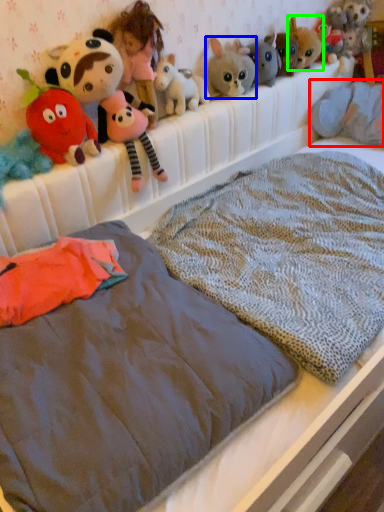
Question: Which is nearer to the animal (highlighted by a red box)? toy (highlighted by a blue box) or toy (highlighted by a green box).

Choices:
 (A) toy
 (B) toy

Answer: (B)